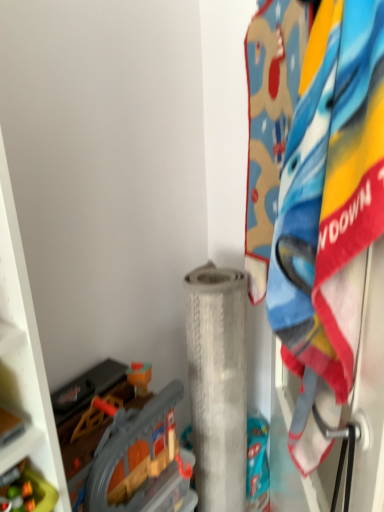
Question: Is the surface of plastic gray train set at lower left, which appears as the 1th toy when viewed from the back, in direct contact with white textured roll at center?

Choices:
 (A) yes
 (B) no

Answer: (B)

Question: Can white textured roll at center be found inside plastic gray train set at lower left, which appears as the second toy when viewed from the front?

Choices:
 (A) yes
 (B) no

Answer: (B)

Question: Is plastic gray train set at lower left, which appears as the second toy when viewed from the front, closer to camera compared to white textured roll at center?

Choices:
 (A) no
 (B) yes

Answer: (B)

Question: Is plastic gray train set at lower left, which appears as the 1th toy when viewed from the back, to the left of white textured roll at center from the viewer's perspective?

Choices:
 (A) no
 (B) yes

Answer: (B)

Question: Can you confirm if plastic gray train set at lower left, which appears as the 1th toy when viewed from the back, is bigger than white textured roll at center?

Choices:
 (A) no
 (B) yes

Answer: (A)

Question: Is fluffy cotton towel at right taller or shorter than white textured roll at center?

Choices:
 (A) tall
 (B) short

Answer: (B)

Question: From the image's perspective, relative to white textured roll at center, is fluffy cotton towel at right above or below?

Choices:
 (A) above
 (B) below

Answer: (A)

Question: Looking at their shapes, would you say fluffy cotton towel at right is wider or thinner than white textured roll at center?

Choices:
 (A) thin
 (B) wide

Answer: (A)

Question: From a real-world perspective, is fluffy cotton towel at right positioned above or below white textured roll at center?

Choices:
 (A) below
 (B) above

Answer: (B)

Question: Is white textured roll at center to the left or to the right of translucent plastic toy at lower left, which ranks as the second toy in back-to-front order, in the image?

Choices:
 (A) right
 (B) left

Answer: (A)

Question: Choose the correct answer: Is white textured roll at center inside translucent plastic toy at lower left, positioned as the first toy in front-to-back order, or outside it?

Choices:
 (A) inside
 (B) outside

Answer: (B)

Question: From a real-world perspective, relative to translucent plastic toy at lower left, positioned as the first toy in front-to-back order, is white textured roll at center vertically above or below?

Choices:
 (A) above
 (B) below

Answer: (B)

Question: Is white textured roll at center in front of or behind translucent plastic toy at lower left, positioned as the first toy in front-to-back order, in the image?

Choices:
 (A) front
 (B) behind

Answer: (B)

Question: In the image, is fluffy cotton towel at right on the left side or the right side of plastic gray train set at lower left, which appears as the 1th toy when viewed from the back?

Choices:
 (A) right
 (B) left

Answer: (A)

Question: From a real-world perspective, is fluffy cotton towel at right above or below plastic gray train set at lower left, which appears as the 1th toy when viewed from the back?

Choices:
 (A) below
 (B) above

Answer: (B)